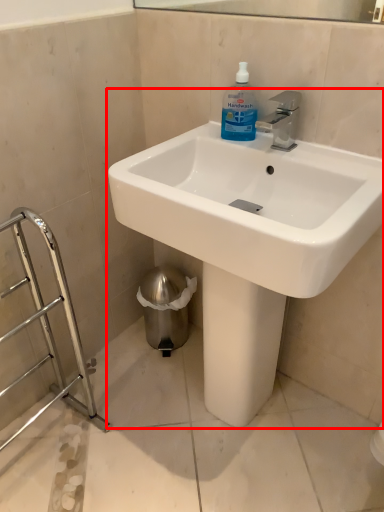
Question: Considering the relative positions of sink (annotated by the red box) and cleaning product in the image provided, where is sink (annotated by the red box) located with respect to the staircase?

Choices:
 (A) left
 (B) right

Answer: (B)